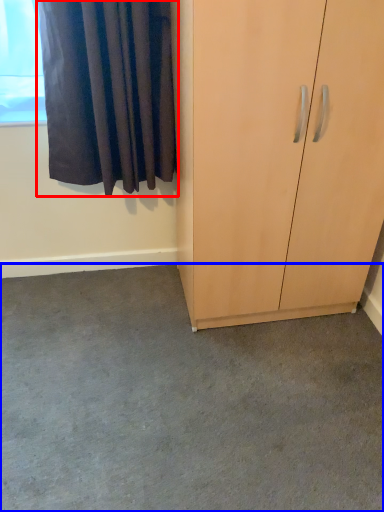
Question: Among these objects, which one is farthest to the camera, curtain (highlighted by a red box) or concrete (highlighted by a blue box)?

Choices:
 (A) curtain
 (B) concrete

Answer: (A)